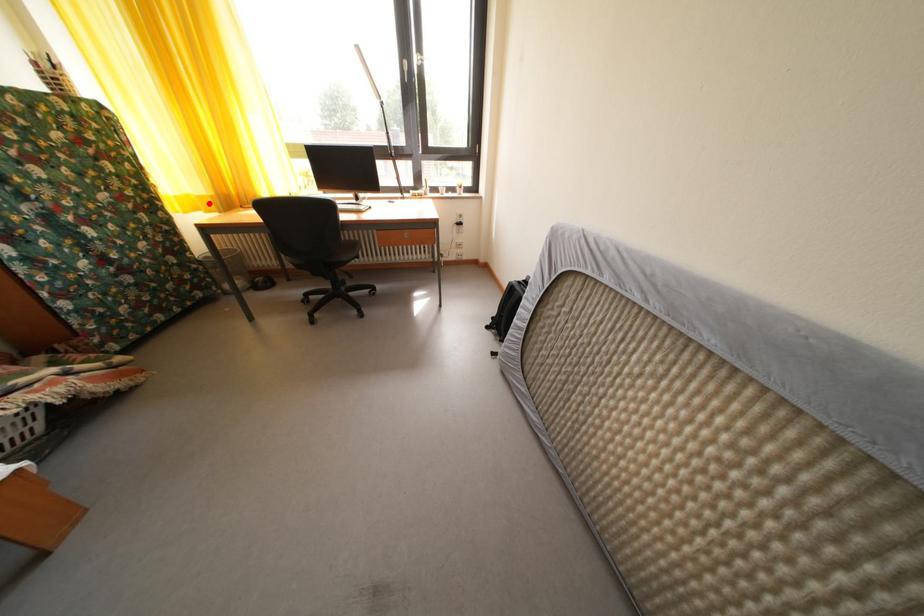
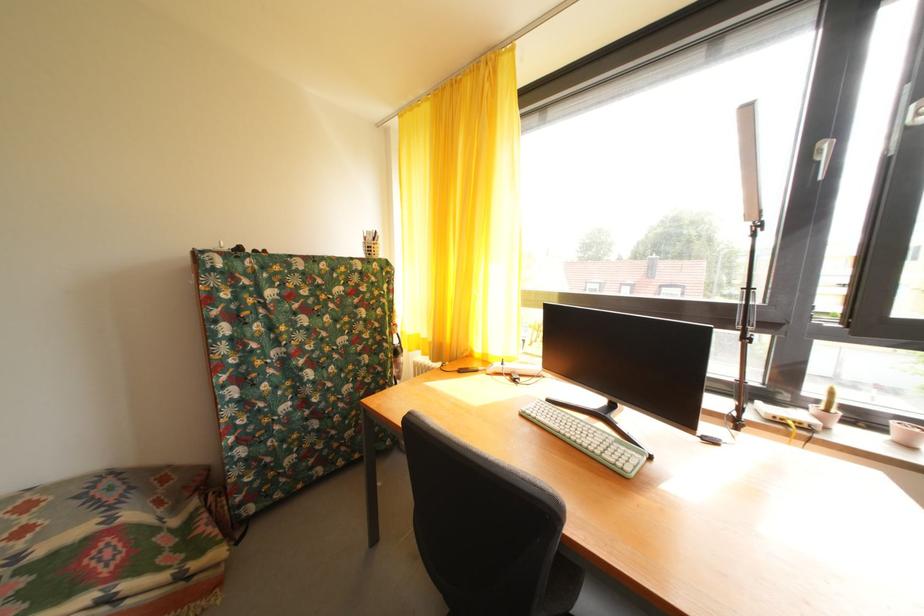
Where in the second image is the point corresponding to the highlighted location from the first image?

(432, 346)